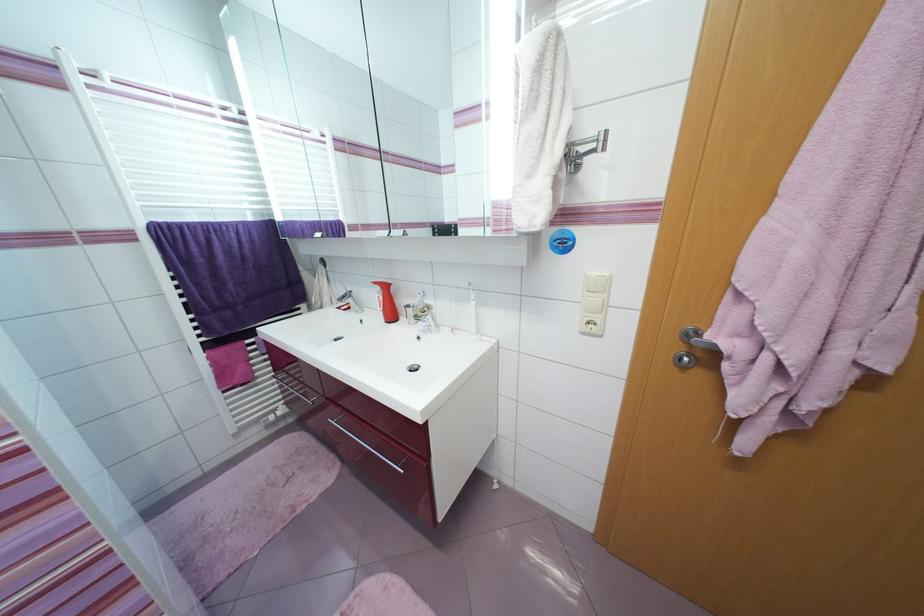
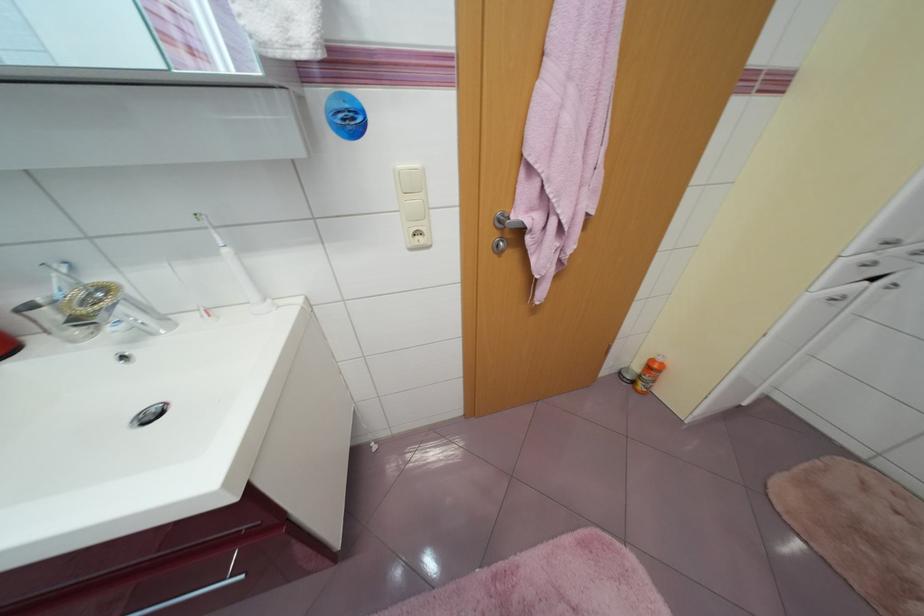
Find the pixel in the second image that matches point 596,328 in the first image.

(423, 238)